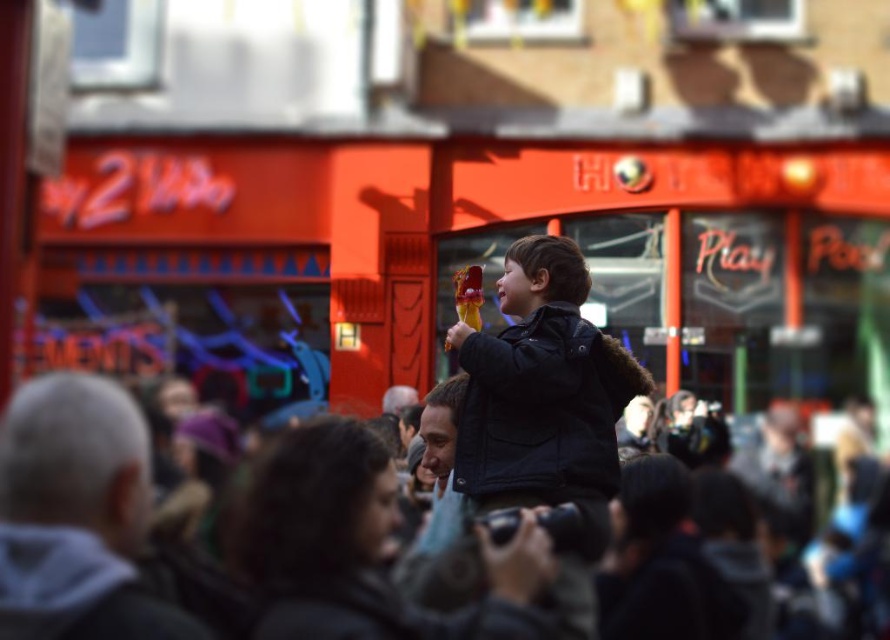
What do you see at coordinates (77, 515) in the screenshot? I see `dark brown leather jacket at center` at bounding box center [77, 515].

Can you confirm if dark brown leather jacket at center is positioned to the left of dark brown hair at center?

Yes, dark brown leather jacket at center is to the left of dark brown hair at center.

The image size is (890, 640). Find the location of `dark brown leather jacket at center`. dark brown leather jacket at center is located at coordinates (77, 515).

Is dark brown leather jacket at center to the left of gray woolen hat at left from the viewer's perspective?

In fact, dark brown leather jacket at center is to the right of gray woolen hat at left.

Image resolution: width=890 pixels, height=640 pixels. Find the location of `dark brown leather jacket at center`. dark brown leather jacket at center is located at coordinates (77, 515).

You are a GUI agent. You are given a task and a screenshot of the screen. Output one action in this format:
    pyautogui.click(x=<x>, y=<y>)
    Task: Click on the dark brown leather jacket at center
    Image resolution: width=890 pixels, height=640 pixels.
    Given the screenshot: What is the action you would take?
    pyautogui.click(x=77, y=515)

Does gray woolen hat at left have a greater height compared to dark brown hair at center?

Yes.

Can you confirm if gray woolen hat at left is positioned to the right of dark brown hair at center?

No, gray woolen hat at left is not to the right of dark brown hair at center.

At what (x,y) coordinates should I click in order to perform the action: click on gray woolen hat at left. Please return your answer as a coordinate pair (x, y). This screenshot has height=640, width=890. Looking at the image, I should click on (77, 515).